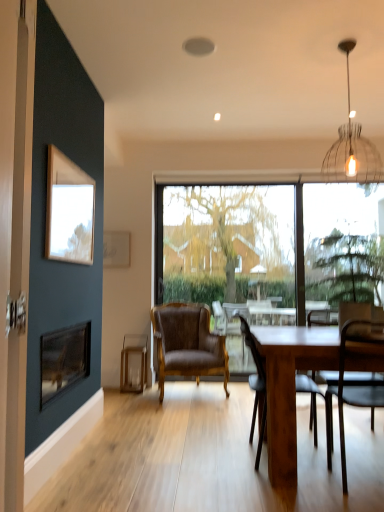
What are the coordinates of `free space above wooden picture frame at upper left, which appears as the second picture frame when viewed from the back (from a real-world perspective)` in the screenshot? It's located at (69, 164).